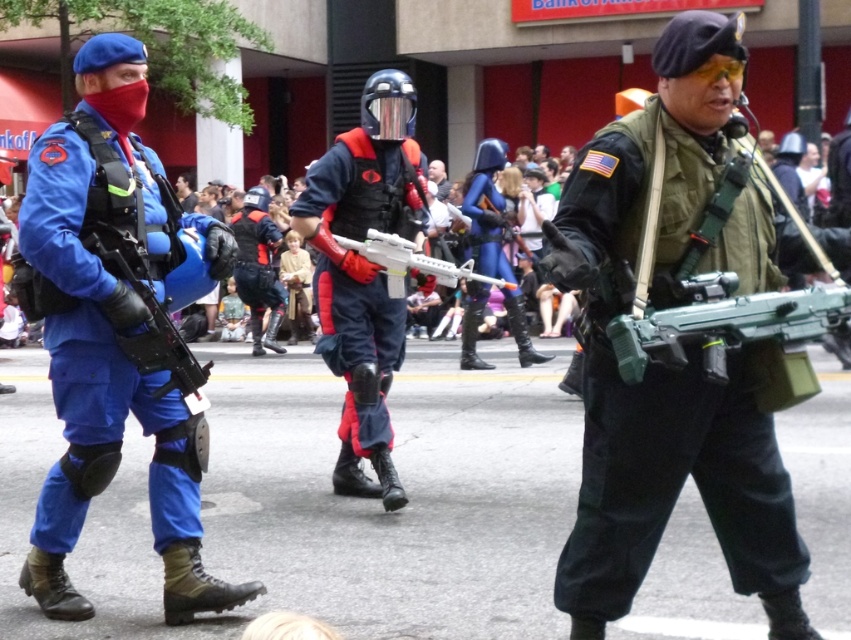
Question: Which of the following is the farthest from the observer?

Choices:
 (A) (664, 460)
 (B) (124, 212)
 (C) (465, 262)

Answer: (C)

Question: Is green plastic toy gun at center wider than white plastic toy gun at center?

Choices:
 (A) yes
 (B) no

Answer: (B)

Question: Among these objects, which one is nearest to the camera?

Choices:
 (A) matte green vest at center
 (B) white plastic toy gun at center
 (C) matte blue uniform at left

Answer: (A)

Question: Which of these objects is positioned closest to the white plastic toy gun at center?

Choices:
 (A) matte green vest at center
 (B) green plastic toy gun at center
 (C) matte blue uniform at left

Answer: (C)

Question: Observing the image, what is the correct spatial positioning of matte blue uniform at left in reference to white plastic toy gun at center?

Choices:
 (A) right
 (B) left

Answer: (B)

Question: Is green plastic toy gun at center further to the viewer compared to white plastic toy gun at center?

Choices:
 (A) no
 (B) yes

Answer: (A)